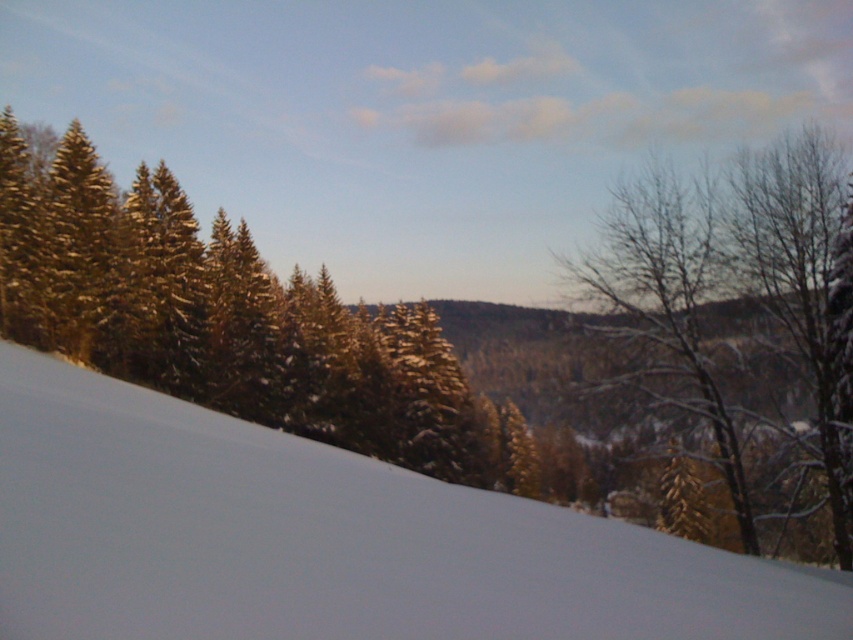
Consider the image. You are standing at the point with coordinates point (648,369) and want to walk towards the point with coordinates point (248,508). Given the snowy terrain, will you have a clear path to walk directly towards your destination?

Point (248,508) is in front of point (648,369), so yes, you can walk directly towards point (248,508) as there are no obstructions between them according to the scene description.